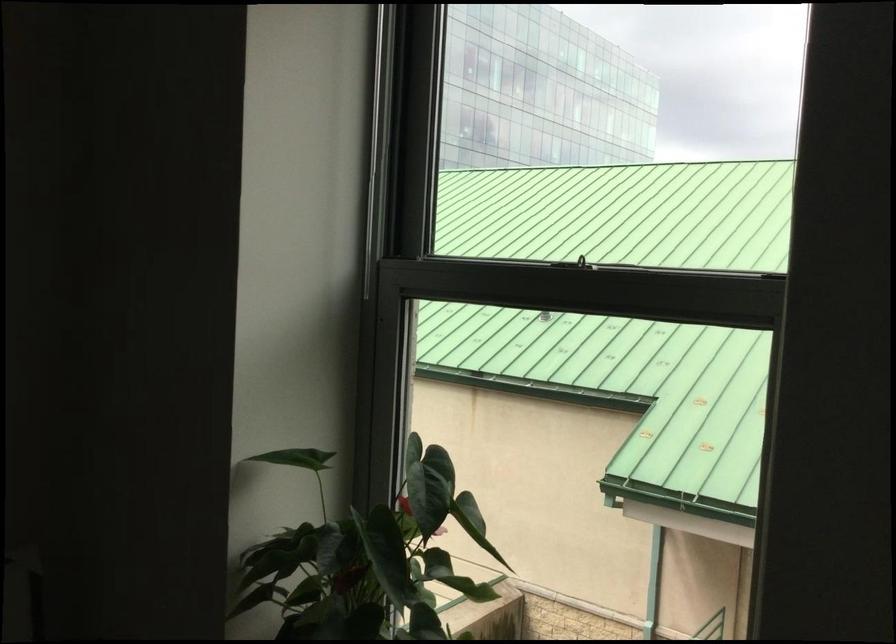
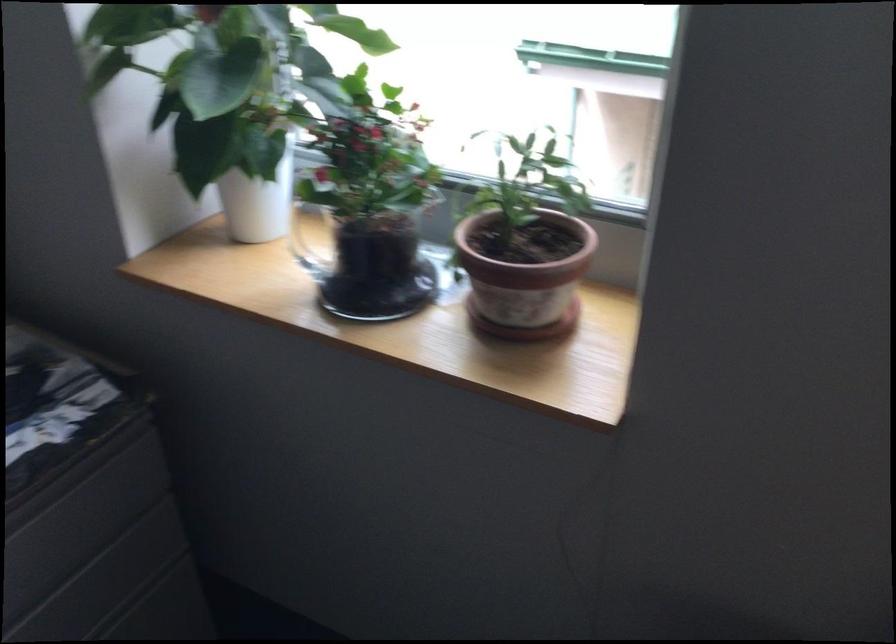
In a continuous first-person perspective shot, in which direction is the camera moving?

The cameraman moved toward right, forward.